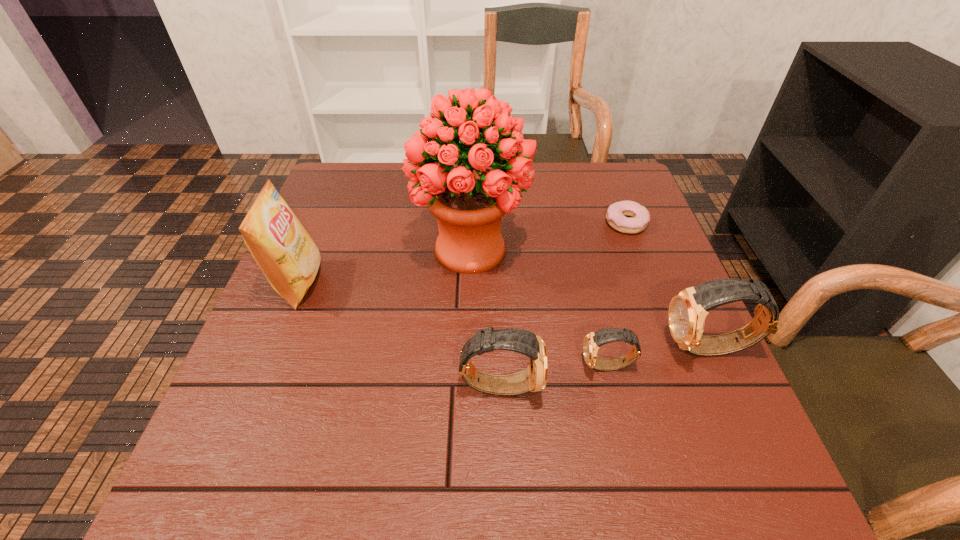
I want to click on blank space located 0.390m on the face of the fourth object from left to right, so click(x=380, y=366).

The width and height of the screenshot is (960, 540). In order to click on free spot located 0.080m on the face of the fourth object from left to right in this screenshot , I will do `click(540, 366)`.

This screenshot has height=540, width=960. I want to click on vacant area situated on the face of the fourth object from left to right, so click(484, 366).

In order to click on free location located on the face of the rightmost watch in this screenshot , I will do `click(611, 348)`.

Locate an element on the screen. This screenshot has height=540, width=960. free location located 0.090m on the face of the rightmost watch is located at coordinates (620, 348).

The image size is (960, 540). In order to click on vacant region located on the face of the rightmost watch in this screenshot , I will do `click(486, 348)`.

The width and height of the screenshot is (960, 540). In order to click on vacant area situated on the back of the bouquet in this screenshot , I will do `click(472, 189)`.

The height and width of the screenshot is (540, 960). Find the location of `free space located 0.390m on the front-facing side of the crisp (potato chip)`. free space located 0.390m on the front-facing side of the crisp (potato chip) is located at coordinates (491, 283).

Where is `vacant position located 0.330m on the front of the doughnut`? This screenshot has height=540, width=960. vacant position located 0.330m on the front of the doughnut is located at coordinates (670, 340).

Identify the location of object located in the near edge section of the desktop. The width and height of the screenshot is (960, 540). (534, 378).